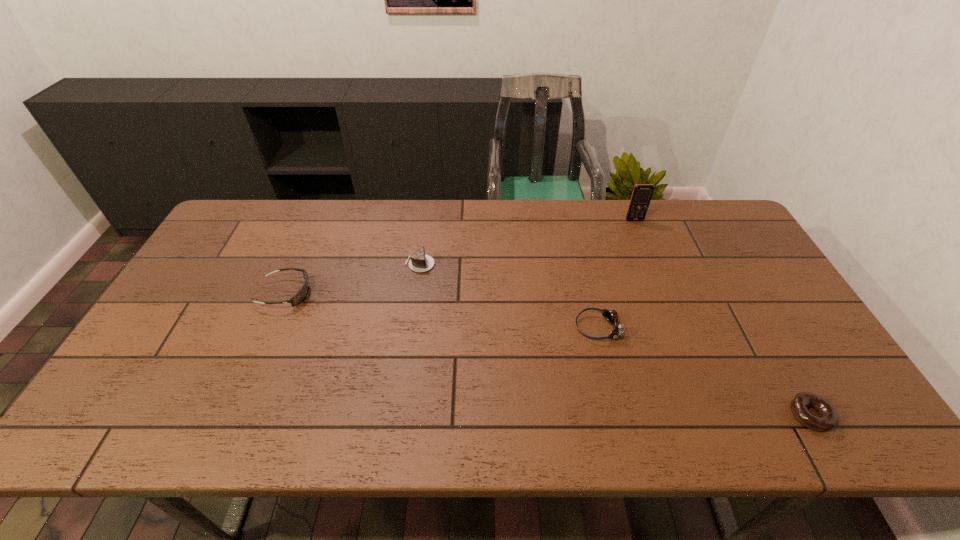
You are a GUI agent. You are given a task and a screenshot of the screen. Output one action in this format:
    pyautogui.click(x=<x>, y=<y>)
    Task: Click on the vacant space that satisfies the following two spatial constraints: 1. through the lenses of the third object from right to left; 2. on the left side of the doughnut
    This screenshot has width=960, height=540.
    Given the screenshot: What is the action you would take?
    pyautogui.click(x=618, y=415)

Find the location of a particular element. vacant space that satisfies the following two spatial constraints: 1. on the screen of the tallest object; 2. through the lenses of the right goggles is located at coordinates (678, 328).

Where is `vacant space that satisfies the following two spatial constraints: 1. on the screen of the cellular telephone; 2. on the lenses of the farther goggles`? vacant space that satisfies the following two spatial constraints: 1. on the screen of the cellular telephone; 2. on the lenses of the farther goggles is located at coordinates (664, 293).

The image size is (960, 540). I want to click on vacant area that satisfies the following two spatial constraints: 1. on the front side of the fourth nearest object; 2. on the lenses of the leftmost object, so click(416, 293).

Where is `blank space that satisfies the following two spatial constraints: 1. through the lenses of the fourth farthest object; 2. on the left side of the nearest object`? The width and height of the screenshot is (960, 540). blank space that satisfies the following two spatial constraints: 1. through the lenses of the fourth farthest object; 2. on the left side of the nearest object is located at coordinates (618, 415).